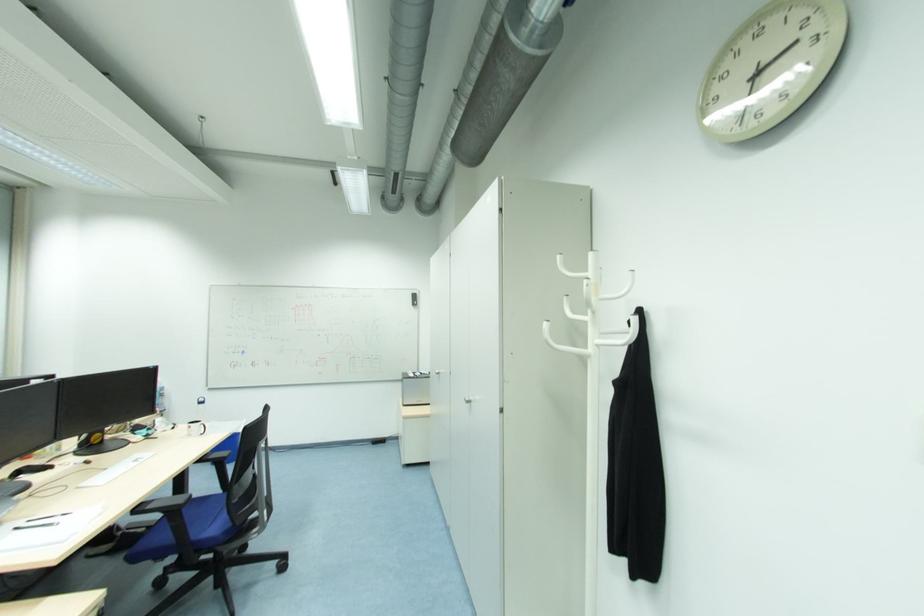
This screenshot has height=616, width=924. What are the coordinates of `white mug handle` in the screenshot? It's located at (196, 428).